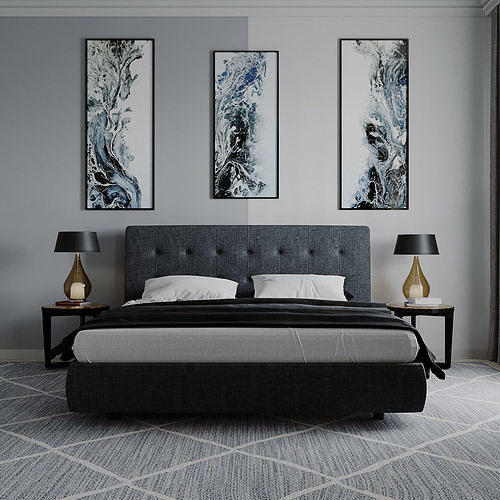
In order to click on books in this screenshot , I will do `click(74, 303)`, `click(430, 300)`, `click(411, 305)`.